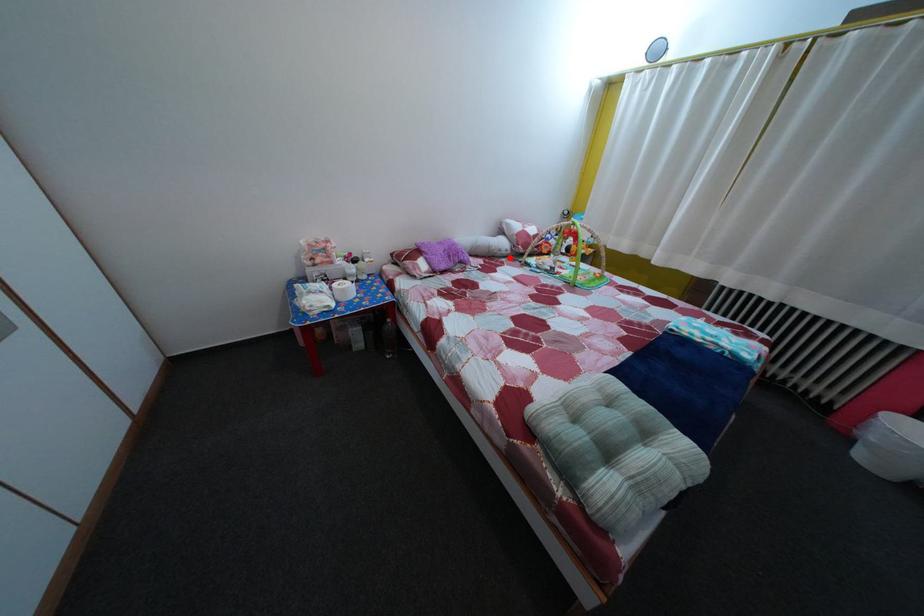
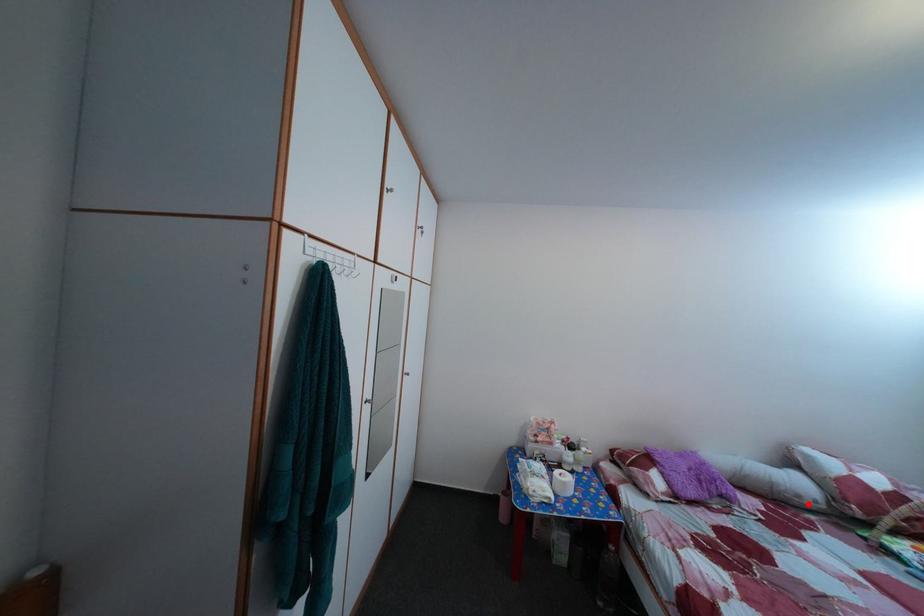
I am providing you with two images of the same scene from different viewpoints. A red point is marked on the first image and another point is marked on the second image. Do the highlighted points in image1 and image2 indicate the same real-world spot?

Yes